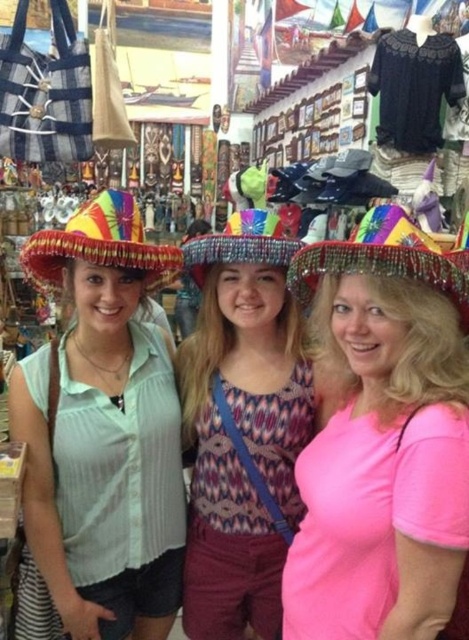
Question: Which point is closer to the camera?

Choices:
 (A) matte fabric sombrero at left
 (B) shiny metallic sombrero at center
 (C) rainbow beaded sombrero at center
 (D) multicolored beaded hat at center

Answer: (B)

Question: Where is shiny metallic sombrero at center located in relation to rainbow fabric sombrero at left in the image?

Choices:
 (A) below
 (B) above

Answer: (A)

Question: Is shiny metallic sombrero at center positioned in front of rainbow fabric sombrero at left?

Choices:
 (A) no
 (B) yes

Answer: (B)

Question: Is matte fabric sombrero at left thinner than rainbow fabric sombrero at left?

Choices:
 (A) no
 (B) yes

Answer: (A)

Question: Which object is positioned closest to the matte fabric sombrero at left?

Choices:
 (A) rainbow beaded sombrero at center
 (B) shiny metallic sombrero at center
 (C) multicolored beaded hat at center

Answer: (C)

Question: Among these objects, which one is nearest to the camera?

Choices:
 (A) multicolored beaded hat at center
 (B) shiny metallic sombrero at center
 (C) matte fabric sombrero at left

Answer: (B)